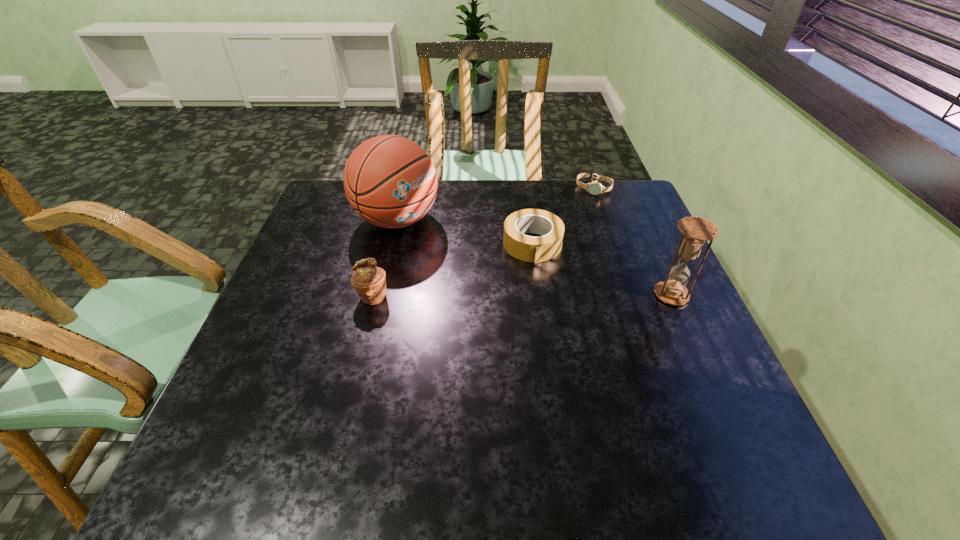
Locate an element on the screen. the fourth closest object relative to the third shortest object is located at coordinates (595, 188).

The image size is (960, 540). Identify the location of object identified as the fourth closest to the watch. (369, 281).

Find the location of a particular element. The width and height of the screenshot is (960, 540). vacant region that satisfies the following two spatial constraints: 1. on the back side of the third tallest object; 2. on the left side of the fourth shortest object is located at coordinates (372, 295).

This screenshot has height=540, width=960. Find the location of `free location that satisfies the following two spatial constraints: 1. on the back side of the basketball; 2. on the right side of the third tallest object`. free location that satisfies the following two spatial constraints: 1. on the back side of the basketball; 2. on the right side of the third tallest object is located at coordinates (392, 220).